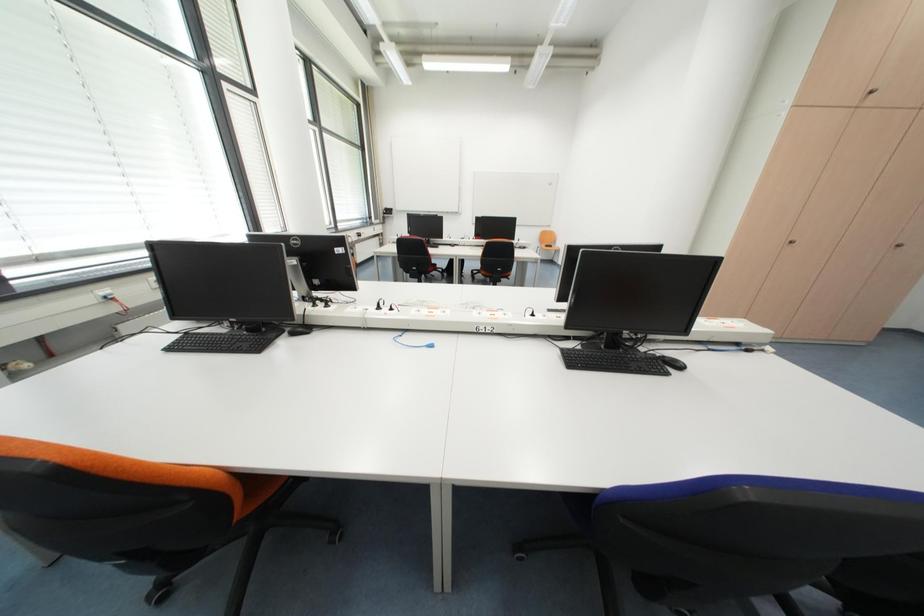
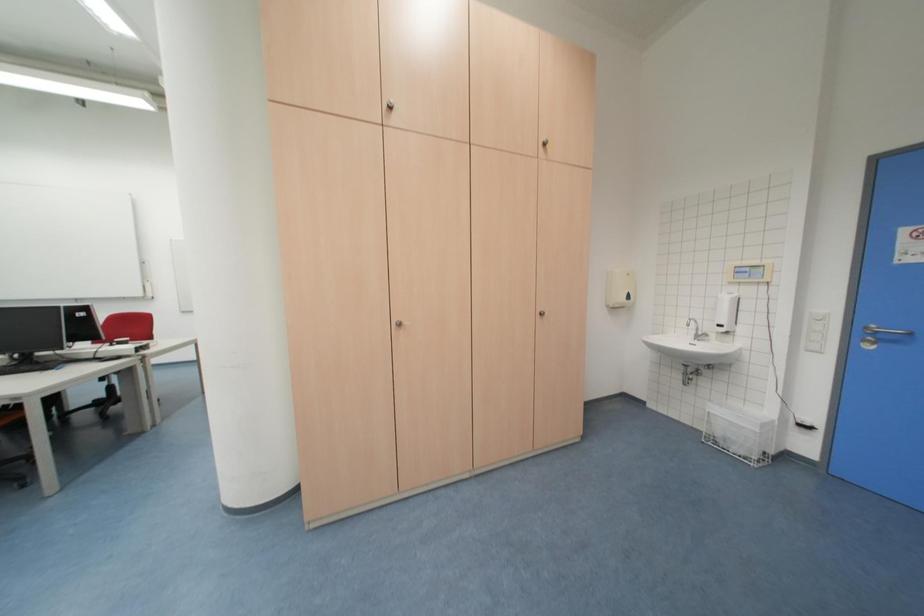
Question: Which direction would the cameraman need to move to produce the second image? Reply with the corresponding letter.

Choices:
 (A) Left
 (B) Right
 (C) Forward
 (D) Backward

Answer: (B)